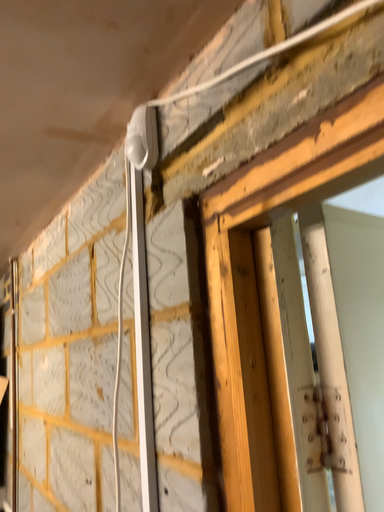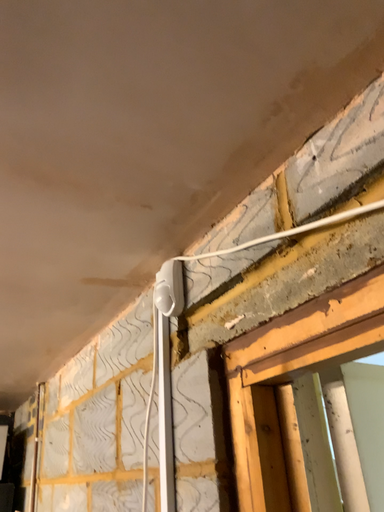
Question: Which way did the camera rotate in the video?

Choices:
 (A) rotated downward
 (B) rotated upward

Answer: (B)